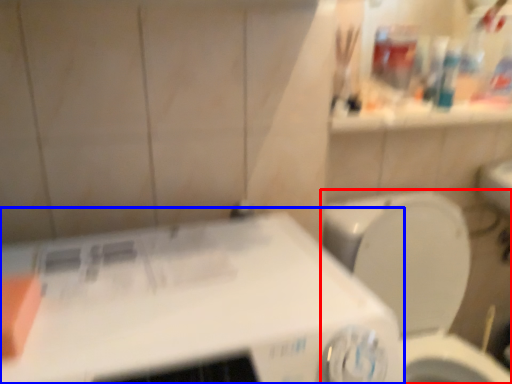
Question: Which of the following is the closest to the observer, toilet (highlighted by a red box) or appliance (highlighted by a blue box)?

Choices:
 (A) toilet
 (B) appliance

Answer: (B)